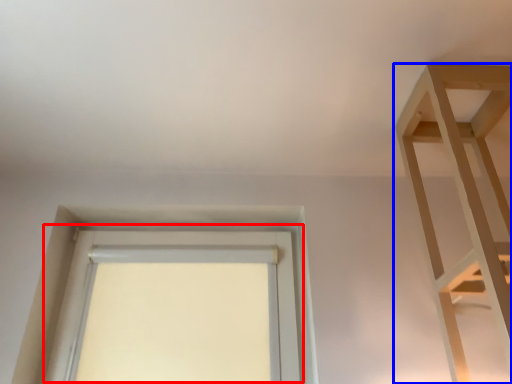
Question: Among these objects, which one is farthest to the camera, window (highlighted by a red box) or shelf (highlighted by a blue box)?

Choices:
 (A) window
 (B) shelf

Answer: (A)